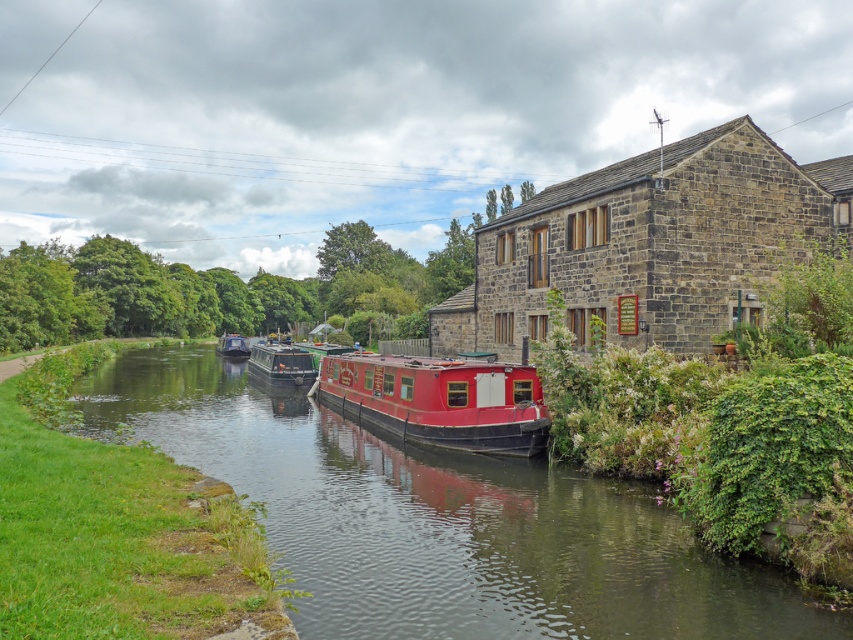
Question: Which point is farther to the camera?

Choices:
 (A) metallic gray barge at center
 (B) smooth water at center

Answer: (A)

Question: Based on their relative distances, which object is nearer to the matte black boat at center?

Choices:
 (A) metallic gray barge at center
 (B) shiny red barge at center

Answer: (A)

Question: Can you confirm if smooth water at center is bigger than matte black boat at center?

Choices:
 (A) no
 (B) yes

Answer: (A)

Question: Is shiny red barge at center bigger than metallic gray barge at center?

Choices:
 (A) yes
 (B) no

Answer: (A)

Question: Which object is farther from the camera taking this photo?

Choices:
 (A) smooth water at center
 (B) matte black boat at center
 (C) shiny red barge at center
 (D) metallic gray barge at center

Answer: (B)

Question: Observing the image, what is the correct spatial positioning of metallic gray barge at center in reference to matte black boat at center?

Choices:
 (A) above
 (B) below

Answer: (B)